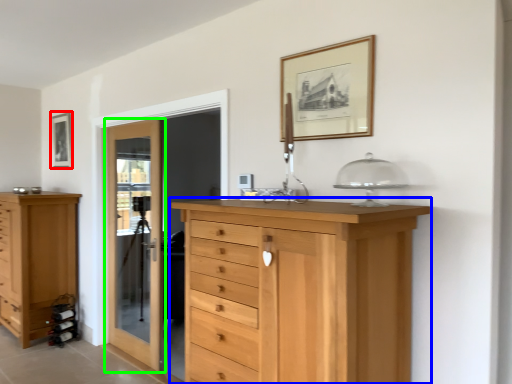
Question: Which object is the closest to the picture frame (highlighted by a red box)? Choose among these: chest of drawers (highlighted by a blue box) or door (highlighted by a green box).

Choices:
 (A) chest of drawers
 (B) door

Answer: (B)